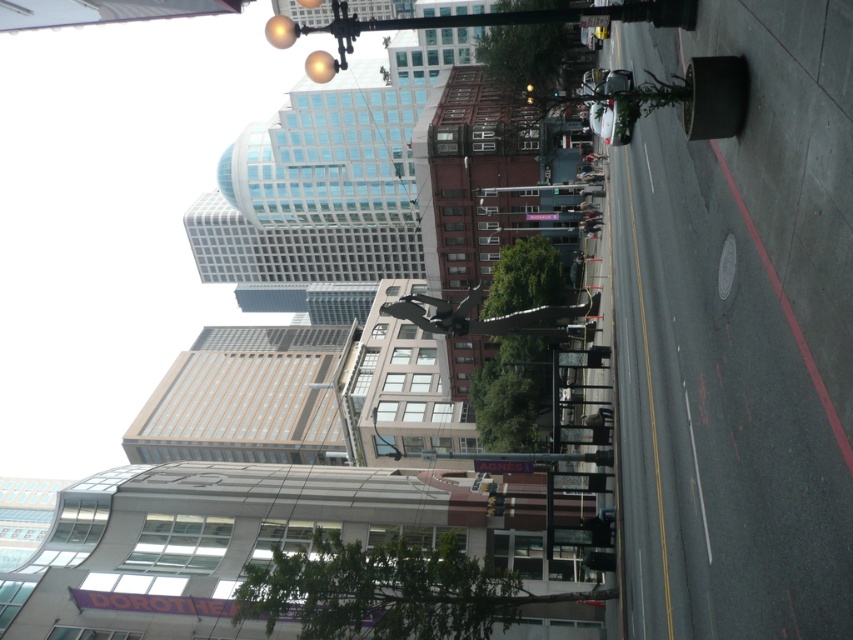
You are a pedestrian trying to cross the street and see both the metallic traffic light at center and the metallic traffic light at upper center. Which one is closer to you?

The metallic traffic light at center is closer to you because the metallic traffic light at upper center is behind it.